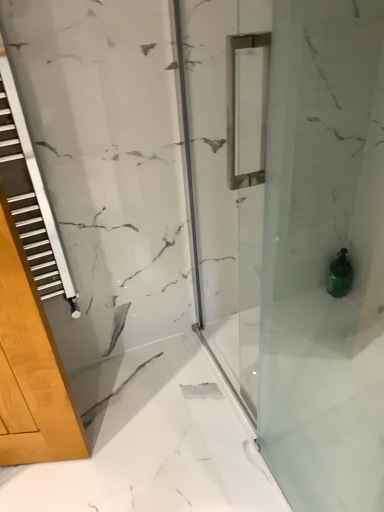
Question: Can you confirm if transparent glass shower door at center is positioned to the left of green glass bottle at lower right?

Choices:
 (A) no
 (B) yes

Answer: (B)

Question: Does transparent glass shower door at center have a smaller size compared to green glass bottle at lower right?

Choices:
 (A) yes
 (B) no

Answer: (B)

Question: Can you confirm if transparent glass shower door at center is thinner than green glass bottle at lower right?

Choices:
 (A) no
 (B) yes

Answer: (B)

Question: From the image's perspective, is transparent glass shower door at center beneath green glass bottle at lower right?

Choices:
 (A) yes
 (B) no

Answer: (B)

Question: Does transparent glass shower door at center have a larger size compared to green glass bottle at lower right?

Choices:
 (A) yes
 (B) no

Answer: (A)

Question: Can green glass bottle at lower right be found inside transparent glass shower door at center?

Choices:
 (A) no
 (B) yes

Answer: (A)

Question: Would you consider green glass bottle at lower right to be distant from transparent glass shower door at center?

Choices:
 (A) yes
 (B) no

Answer: (B)

Question: Is green glass bottle at lower right thinner than transparent glass shower door at center?

Choices:
 (A) no
 (B) yes

Answer: (A)

Question: Can you confirm if green glass bottle at lower right is positioned to the left of transparent glass shower door at center?

Choices:
 (A) yes
 (B) no

Answer: (B)

Question: Is the surface of green glass bottle at lower right in direct contact with transparent glass shower door at center?

Choices:
 (A) yes
 (B) no

Answer: (B)

Question: Is green glass bottle at lower right further to camera compared to transparent glass shower door at center?

Choices:
 (A) no
 (B) yes

Answer: (B)

Question: Does green glass bottle at lower right turn towards transparent glass shower door at center?

Choices:
 (A) yes
 (B) no

Answer: (A)

Question: Is point (263, 323) positioned closer to the camera than point (345, 265)?

Choices:
 (A) farther
 (B) closer

Answer: (B)